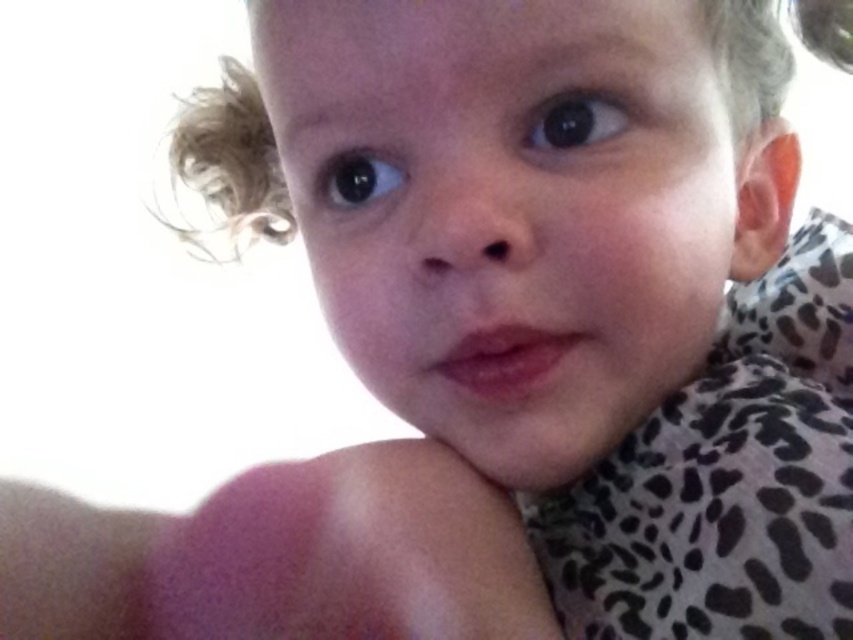
Question: Estimate the real-world distances between objects in this image. Which object is farther from the blonde curly hair at upper left?

Choices:
 (A) black glossy eye at upper center
 (B) black glossy eye at upper left

Answer: (A)

Question: Which is nearer to the black glossy eye at upper center?

Choices:
 (A) blonde curly hair at upper left
 (B) black glossy eye at upper left

Answer: (B)

Question: Can you confirm if black glossy eye at upper center is wider than black glossy eye at upper left?

Choices:
 (A) yes
 (B) no

Answer: (A)

Question: Is blonde curly hair at upper left below black glossy eye at upper left?

Choices:
 (A) no
 (B) yes

Answer: (A)

Question: Which point is closer to the camera?

Choices:
 (A) black glossy eye at upper left
 (B) blonde curly hair at upper left

Answer: (A)

Question: Is black glossy eye at upper center to the right of black glossy eye at upper left from the viewer's perspective?

Choices:
 (A) no
 (B) yes

Answer: (B)